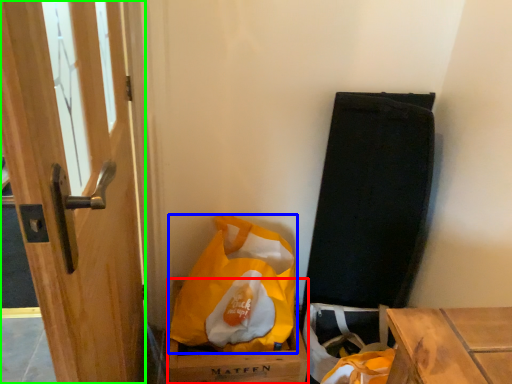
Question: Estimate the real-world distances between objects in this image. Which object is farther from cardboard box (highlighted by a red box), plastic bag (highlighted by a blue box) or door (highlighted by a green box)?

Choices:
 (A) plastic bag
 (B) door

Answer: (B)